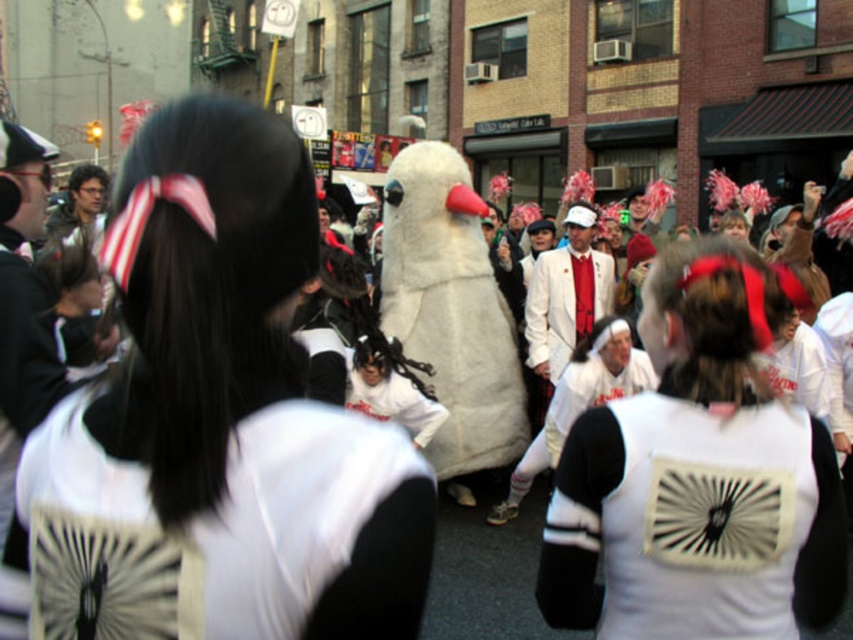
Question: Is white matte fan at center to the left of white matte jersey at center from the viewer's perspective?

Choices:
 (A) no
 (B) yes

Answer: (B)

Question: Which point appears farthest from the camera in this image?

Choices:
 (A) (585, 460)
 (B) (560, 262)
 (C) (41, 476)

Answer: (B)

Question: Which object is positioned farthest from the white matte suit at center?

Choices:
 (A) white matte fan at center
 (B) white matte jersey at center

Answer: (A)

Question: Which object is closer to the camera taking this photo?

Choices:
 (A) white matte jersey at center
 (B) white matte fan at center
 (C) white matte suit at center

Answer: (B)

Question: In this image, where is white matte jersey at center located relative to white matte suit at center?

Choices:
 (A) left
 (B) right

Answer: (A)

Question: Is white matte fan at center positioned behind white matte jersey at center?

Choices:
 (A) no
 (B) yes

Answer: (A)